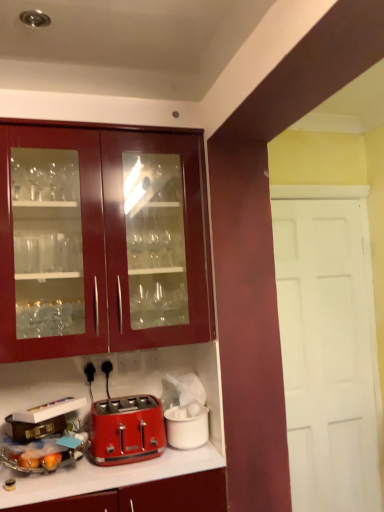
You are a GUI agent. You are given a task and a screenshot of the screen. Output one action in this format:
    pyautogui.click(x=<x>, y=<y>)
    Task: Click on the vacant space situated above matte red toaster at lower left, which is the second appliance from right to left (from a real-world perspective)
    
    Given the screenshot: What is the action you would take?
    pyautogui.click(x=43, y=443)